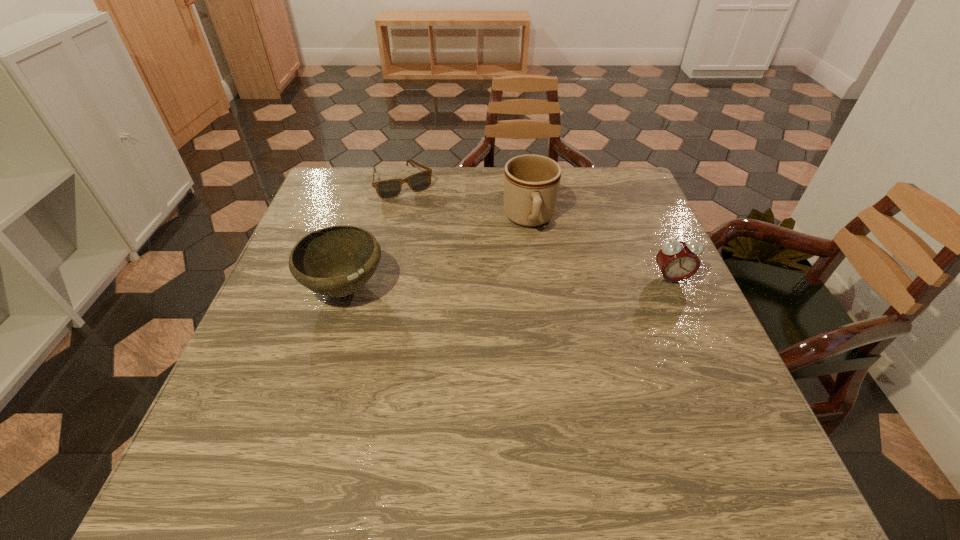
Where is `free space on the desktop that is between the bowl and the alarm clock and is positioned on the frames of the shortest object`? free space on the desktop that is between the bowl and the alarm clock and is positioned on the frames of the shortest object is located at coordinates (468, 285).

Where is `vacant spot on the desktop that is between the bowl and the alarm clock and is positioned on the side of the mug with the handle`? vacant spot on the desktop that is between the bowl and the alarm clock and is positioned on the side of the mug with the handle is located at coordinates (539, 282).